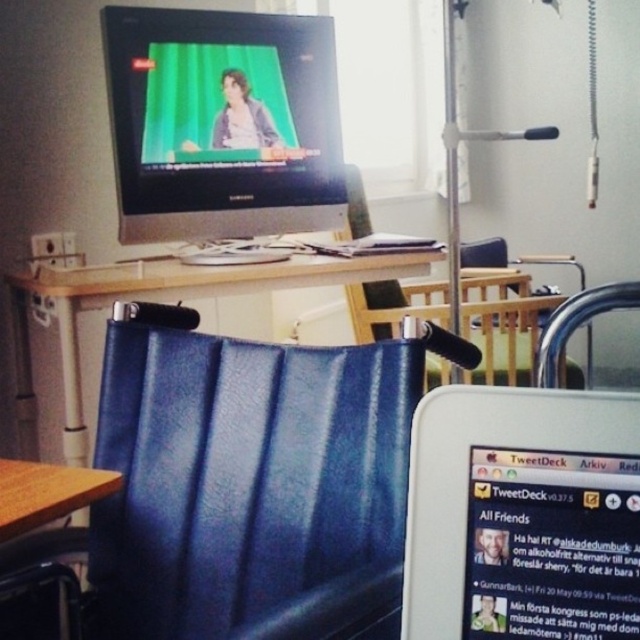
You are a patient in the hospital bed and want to reach both the point at coordinates point (35, 449) and point (29, 509) in the room. Which point will you reach first?

You will reach point (35, 449) first because it is closer to you than point (29, 509), which is further away.

You are a patient in the hospital room and want to check the monitor to see the video call. Which object should you look at first, the matte black monitor at upper center or the wooden desk at center?

The matte black monitor at upper center is positioned over the wooden desk at center, so you should look at the matte black monitor at upper center first to see the video call.